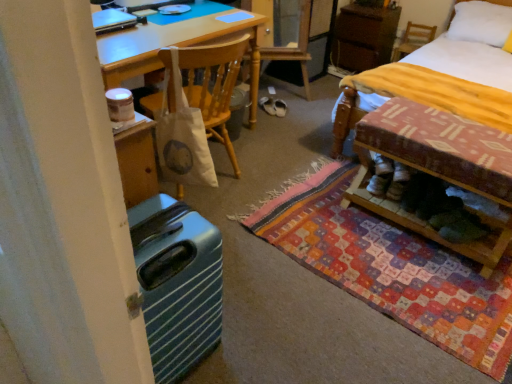
You are a GUI agent. You are given a task and a screenshot of the screen. Output one action in this format:
    pyautogui.click(x=<x>, y=<y>)
    Task: Click on the unoccupied region to the right of white fabric shoe at center, marked as the 2th footwear in a right-to-left arrangement
    This screenshot has width=512, height=384.
    Given the screenshot: What is the action you would take?
    (297, 108)